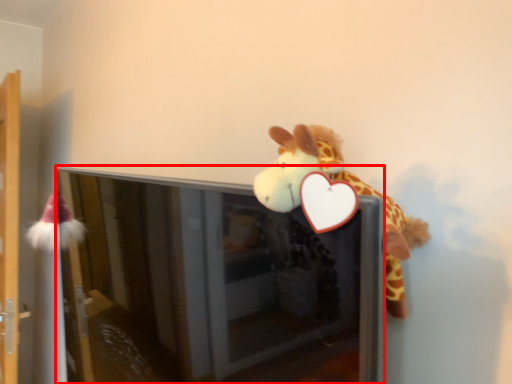
Question: From the image, what is the correct spatial relationship of screen door (annotated by the red box) in relation to shelf?

Choices:
 (A) left
 (B) right

Answer: (B)